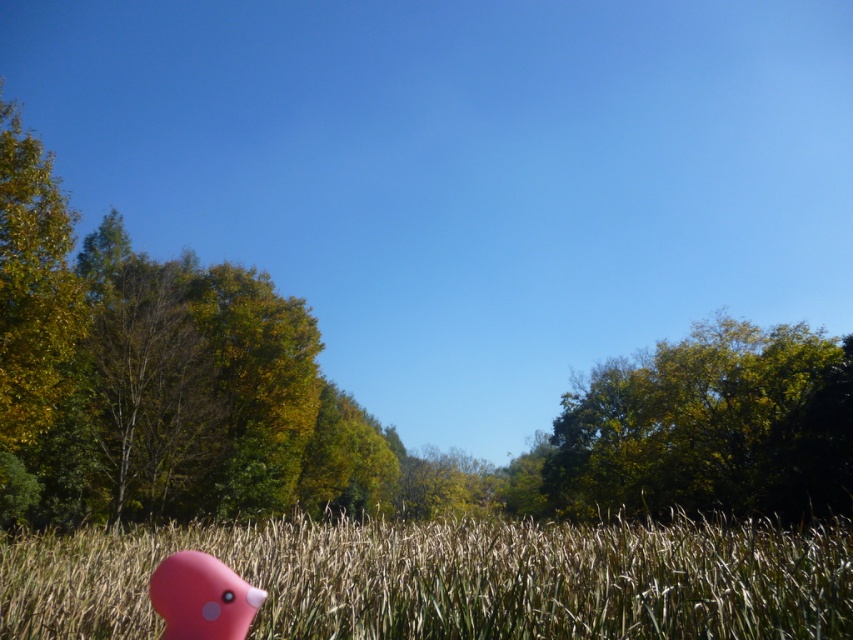
Can you confirm if grassy field at lower center is thinner than pink rubber duck at lower left?

No, grassy field at lower center is not thinner than pink rubber duck at lower left.

The width and height of the screenshot is (853, 640). What are the coordinates of `grassy field at lower center` in the screenshot? It's located at (450, 579).

Does grassy field at lower center have a greater height compared to green leafy tree at upper right?

No.

Is point (32, 560) closer to camera compared to point (677, 381)?

Yes, it is.

Does point (653, 525) come farther from viewer compared to point (585, 381)?

No.

The width and height of the screenshot is (853, 640). In order to click on grassy field at lower center in this screenshot , I will do `click(450, 579)`.

Between green leafy tree at upper right and pink rubber duck at lower left, which one appears on the right side from the viewer's perspective?

From the viewer's perspective, green leafy tree at upper right appears more on the right side.

Which is in front, point (763, 488) or point (180, 627)?

Positioned in front is point (180, 627).

I want to click on green leafy tree at upper right, so click(x=709, y=428).